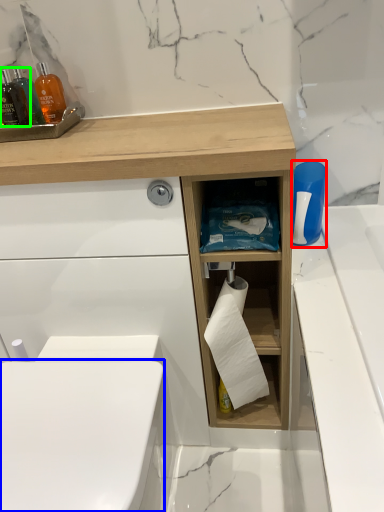
Question: Which is farther away from cleaning product (highlighted by a red box)? toilet bowl (highlighted by a blue box) or mouthwash (highlighted by a green box)?

Choices:
 (A) toilet bowl
 (B) mouthwash

Answer: (B)